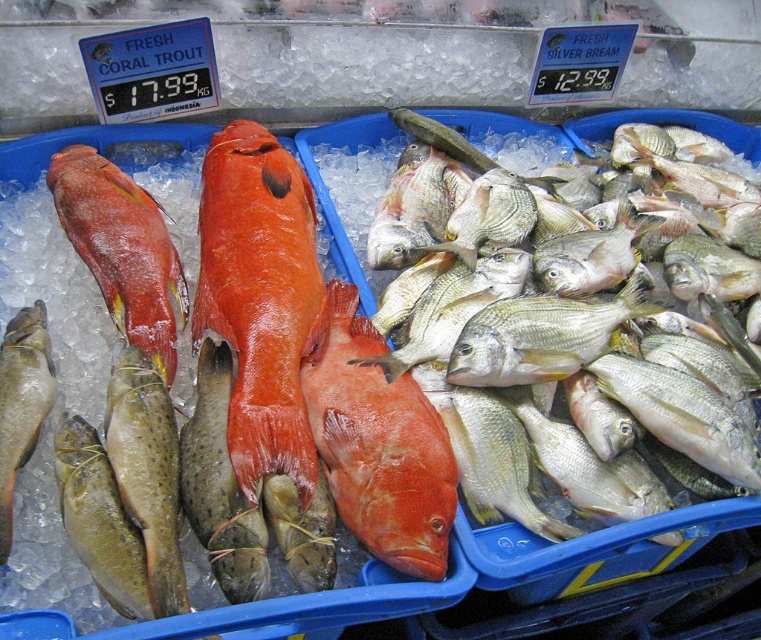
Question: Which object is closer to the camera taking this photo?

Choices:
 (A) speckled yellow-green fish at lower left
 (B) shiny red fish at center
 (C) speckled yellow fish at lower left
 (D) spotted green at center

Answer: (A)

Question: Which of these objects is positioned closest to the matte red fish at left?

Choices:
 (A) spotted green at center
 (B) speckled yellow fish at lower left

Answer: (A)

Question: From the image, what is the correct spatial relationship of shiny red fish at center in relation to matte red fish at center?

Choices:
 (A) right
 (B) left

Answer: (B)

Question: Does shiny red fish at center lie behind spotted green at center?

Choices:
 (A) yes
 (B) no

Answer: (A)

Question: Does shiny silver fish at center appear under speckled yellow fish at lower left?

Choices:
 (A) no
 (B) yes

Answer: (A)

Question: Which point is closer to the camera taking this photo?

Choices:
 (A) pos(393,365)
 (B) pos(215,532)
 (C) pos(279,161)

Answer: (B)